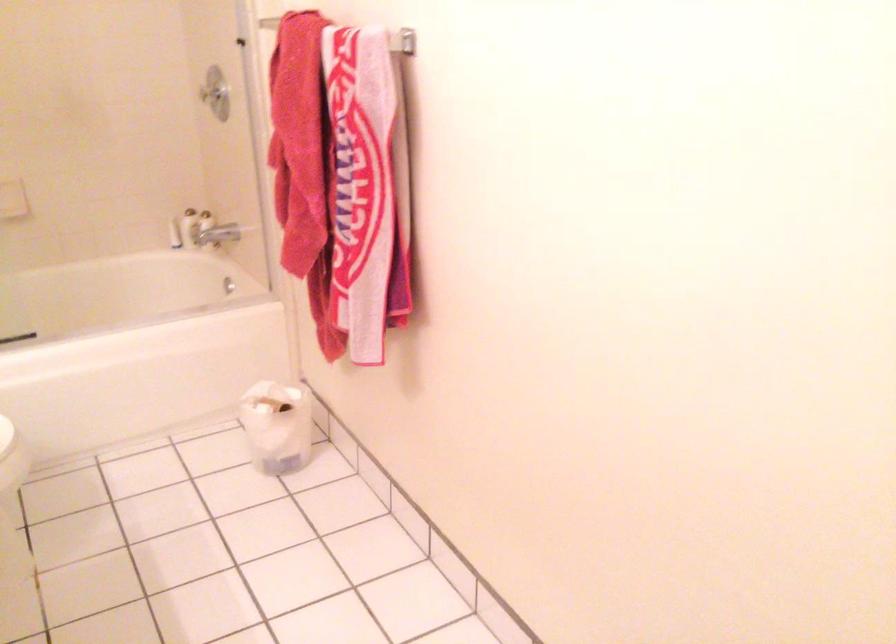
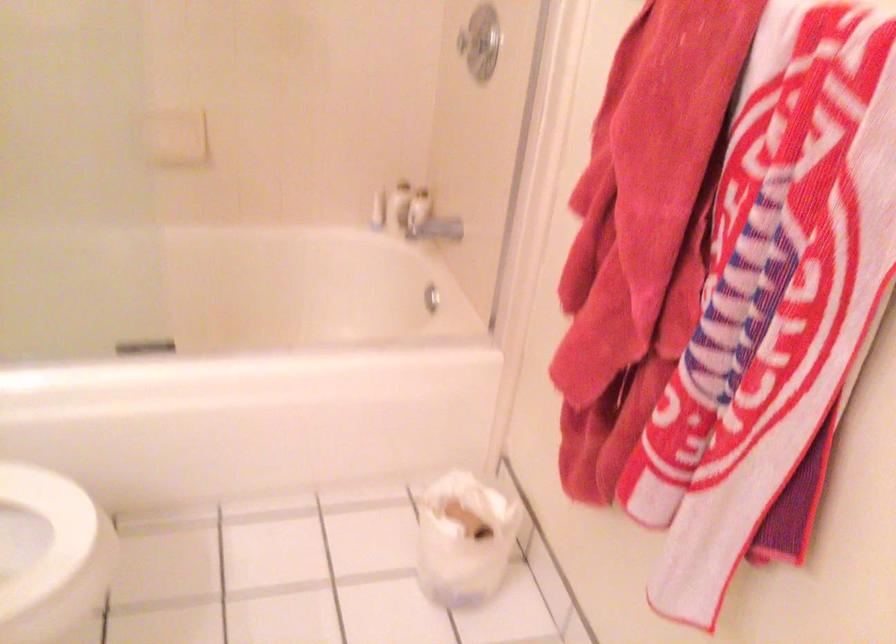
In the second image, find the point that corresponds to [177,236] in the first image.

(378, 211)